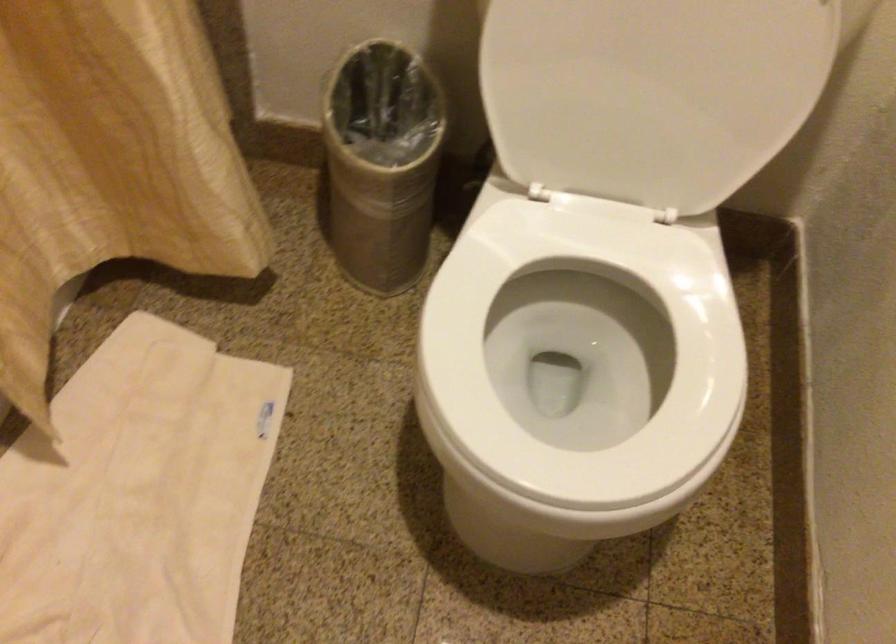
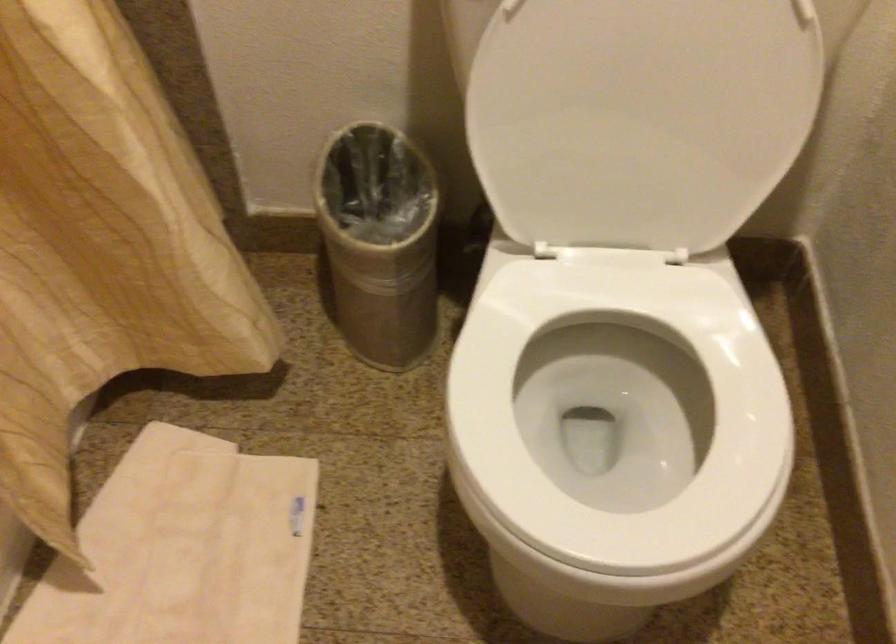
In the second image, find the point that corresponds to pixel 380 164 in the first image.

(380, 242)